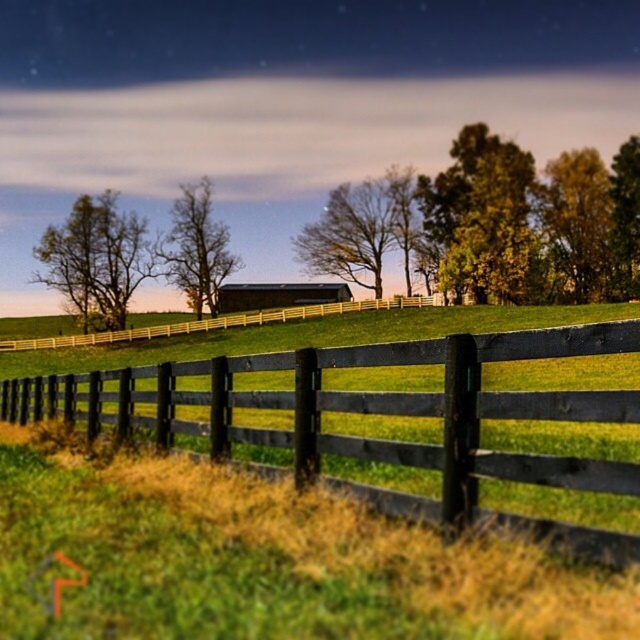
Question: Which point is closer to the camera?

Choices:
 (A) (253, 289)
 (B) (230, 371)
 (C) (296, 317)

Answer: (B)

Question: Estimate the real-world distances between objects in this image. Which object is farther from the dark gray wooden barn at center?

Choices:
 (A) brown wooden fence at center
 (B) black wooden fence at center

Answer: (B)

Question: Considering the relative positions of black wooden fence at center and dark gray wooden barn at center in the image provided, where is black wooden fence at center located with respect to dark gray wooden barn at center?

Choices:
 (A) above
 (B) below

Answer: (B)

Question: Considering the relative positions of black wooden fence at center and brown wooden fence at center in the image provided, where is black wooden fence at center located with respect to brown wooden fence at center?

Choices:
 (A) left
 (B) right

Answer: (B)

Question: Among these objects, which one is farthest from the camera?

Choices:
 (A) black wooden fence at center
 (B) brown wooden fence at center
 (C) dark gray wooden barn at center

Answer: (C)

Question: Can you confirm if black wooden fence at center is positioned to the left of dark gray wooden barn at center?

Choices:
 (A) no
 (B) yes

Answer: (A)